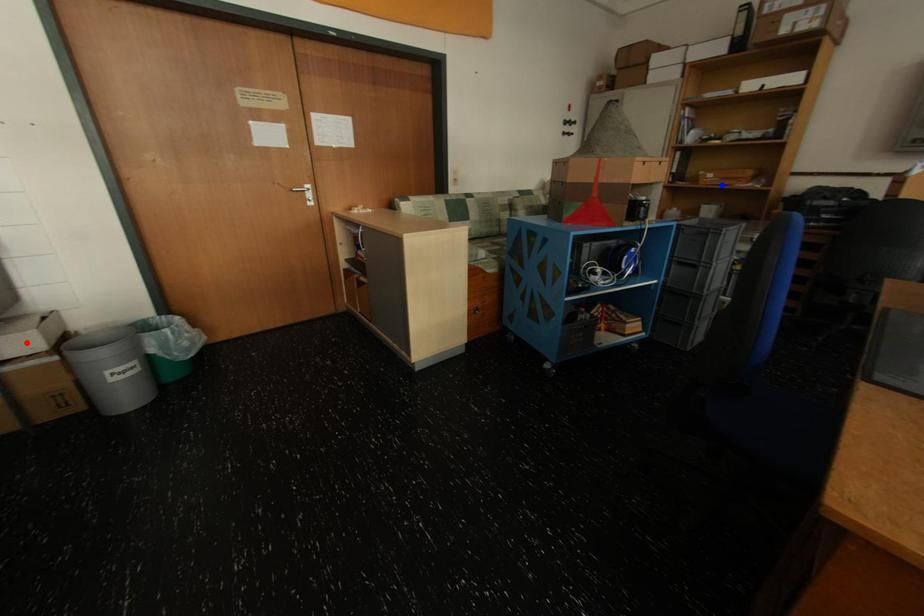
Question: In the image, two points are highlighted. Which point is nearer to the camera? Reply with the corresponding letter.

Choices:
 (A) blue point
 (B) red point

Answer: (B)